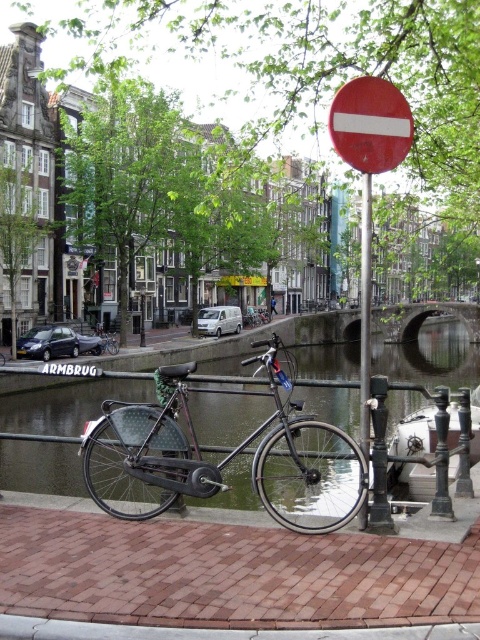
Who is more forward, (309, 432) or (361, 444)?

Positioned in front is point (361, 444).

Can you confirm if matte black bicycle at center is positioned to the left of metallic pole at center?

Correct, you'll find matte black bicycle at center to the left of metallic pole at center.

Between point (300, 502) and point (364, 188), which one is positioned behind?

The point (300, 502) is behind.

Identify the location of matte black bicycle at center. (x=224, y=458).

Is brick pavement at lower center further to camera compared to matte red circle at center?

No, brick pavement at lower center is closer to the viewer.

Is point (214, 532) closer to viewer compared to point (365, 140)?

No, (214, 532) is further to viewer.

Who is more forward, (384, 554) or (368, 172)?

Positioned in front is point (384, 554).

This screenshot has height=640, width=480. I want to click on brick pavement at lower center, so click(228, 573).

Locate an element on the screen. The width and height of the screenshot is (480, 640). metallic pole at center is located at coordinates (364, 314).

Which is behind, point (365, 275) or point (98, 352)?

Positioned behind is point (98, 352).

I want to click on metallic pole at center, so click(x=364, y=314).

Locate an element on the screen. The height and width of the screenshot is (640, 480). metallic pole at center is located at coordinates pos(364,314).